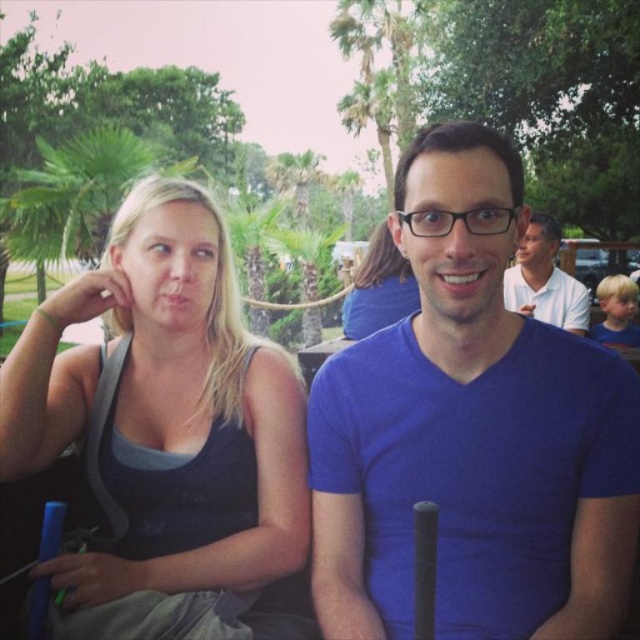
Is point (412, 173) closer to camera compared to point (628, 305)?

Yes, point (412, 173) is in front of point (628, 305).

Does blue matte shirt at center have a lesser width compared to matte black tank top at center?

No, blue matte shirt at center is not thinner than matte black tank top at center.

Find the location of `blue matte shirt at center`. blue matte shirt at center is located at coordinates (472, 433).

Who is higher up, blue matte shirt at center or matte blue tank top at center?

matte blue tank top at center is higher up.

Does blue matte shirt at center have a greater height compared to matte blue tank top at center?

Correct, blue matte shirt at center is much taller as matte blue tank top at center.

Is point (339, 538) less distant than point (376, 250)?

Yes, it is in front of point (376, 250).

I want to click on blue matte shirt at center, so click(x=472, y=433).

Is matte blue tank top at center shorter than matte black tank top at center?

No, matte blue tank top at center is not shorter than matte black tank top at center.

Does point (392, 288) come in front of point (612, 312)?

That is True.

Where is `matte blue tank top at center`? matte blue tank top at center is located at coordinates (378, 289).